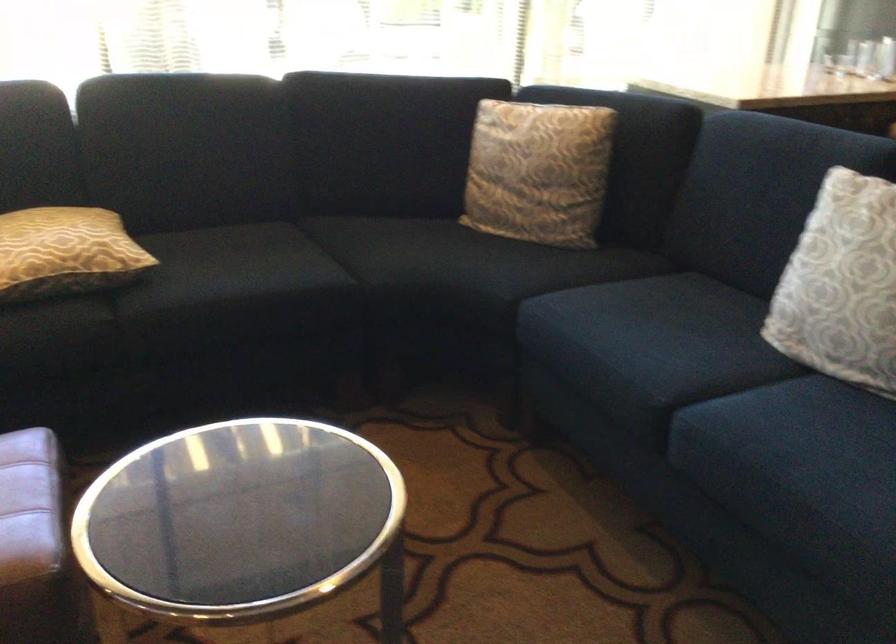
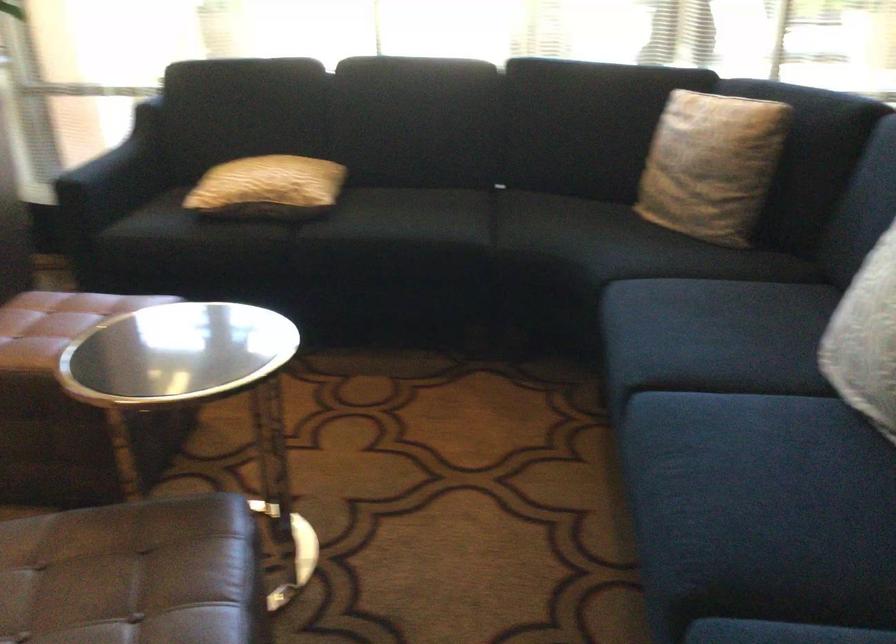
In the second image, find the point that corresponds to point (70, 257) in the first image.

(268, 187)